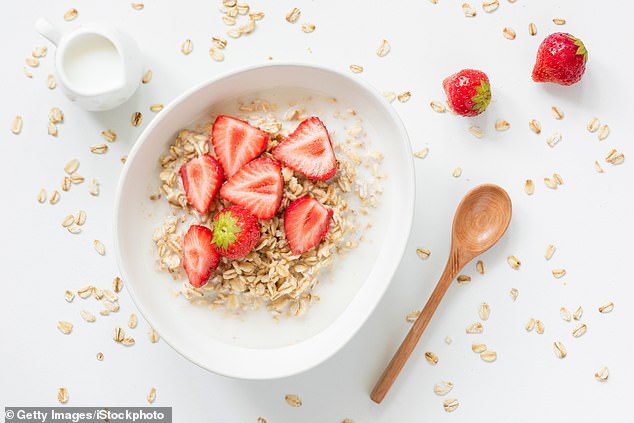
Where is `cereal on counter`? The image size is (634, 423). cereal on counter is located at coordinates (189, 45).